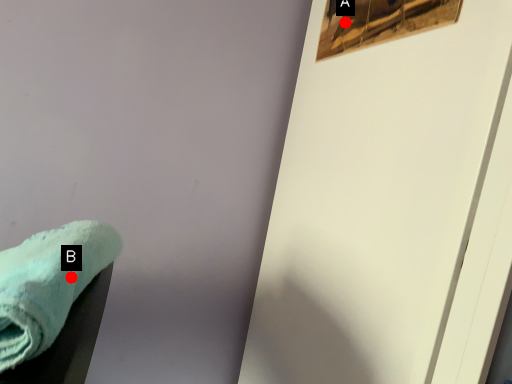
Question: Two points are circled on the image, labeled by A and B beside each circle. Which point is closer to the camera?

Choices:
 (A) A is closer
 (B) B is closer

Answer: (B)